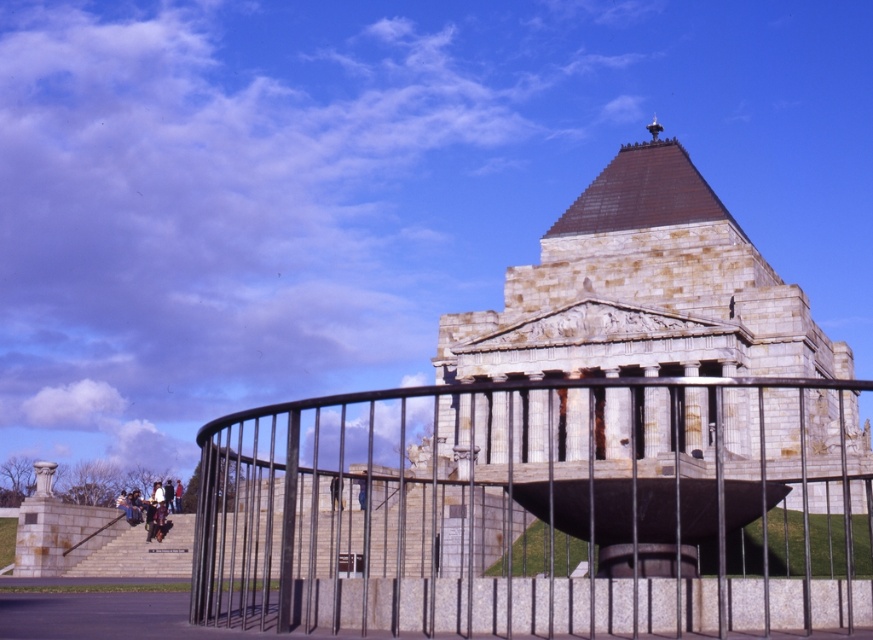
Question: Is metallic black fence at center wider than light gray stone stairs at lower left?

Choices:
 (A) no
 (B) yes

Answer: (B)

Question: Estimate the real-world distances between objects in this image. Which object is closer to the light gray stone stairs at lower left?

Choices:
 (A) dark brown leather jacket at center
 (B) stone/concrete church at center
 (C) metallic black fence at center

Answer: (A)

Question: Does metallic black fence at center have a greater width compared to stone/concrete church at center?

Choices:
 (A) no
 (B) yes

Answer: (B)

Question: Which point is closer to the camera?

Choices:
 (A) (169, 552)
 (B) (650, 168)
 (C) (332, 496)
 (D) (733, 486)

Answer: (D)

Question: Among these points, which one is nearest to the camera?

Choices:
 (A) (609, 339)
 (B) (120, 568)

Answer: (B)

Question: Is light gray stone stairs at lower left above dark brown leather jacket at center?

Choices:
 (A) no
 (B) yes

Answer: (A)